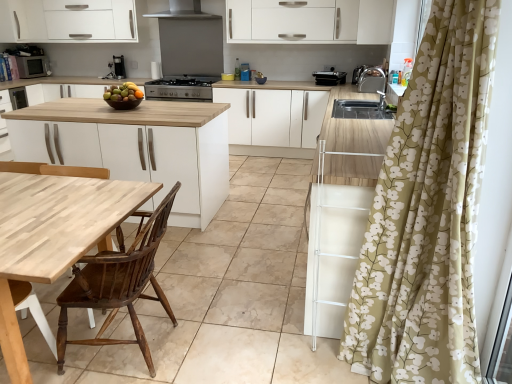
Identify the location of stainless steel exhaust hood at upper center. The image size is (512, 384). (183, 11).

How much space does white matte cabinet at upper left, which is the 1th cabinetry from left to right, occupy horizontally?

white matte cabinet at upper left, which is the 1th cabinetry from left to right, is 15.62 inches in width.

What do you see at coordinates (274, 120) in the screenshot?
I see `white matte cabinet at center, acting as the 3th cabinetry starting from the top` at bounding box center [274, 120].

Locate an element on the screen. This screenshot has height=384, width=512. white matte cabinet at upper right, positioned as the second cabinetry in top-to-bottom order is located at coordinates (375, 22).

In the scene shown: How much space does light brown wood chair at lower left, which appears as the second chair when viewed from the left, occupy vertically?

light brown wood chair at lower left, which appears as the second chair when viewed from the left, is 81.60 centimeters in height.

Identify the location of shiny brown bowl of mixed fruits at center. This screenshot has width=512, height=384. (123, 92).

Does wooden chair at left, the 1th chair positioned from the left, appear on the left side of white matte cabinet at upper left, the first cabinetry viewed from the top?

In fact, wooden chair at left, the 1th chair positioned from the left, is to the right of white matte cabinet at upper left, the first cabinetry viewed from the top.

Is wooden chair at left, acting as the 3th chair starting from the right, located outside white matte cabinet at upper left, which is the 1th cabinetry from left to right?

Indeed, wooden chair at left, acting as the 3th chair starting from the right, is completely outside white matte cabinet at upper left, which is the 1th cabinetry from left to right.

From a real-world perspective, is wooden chair at left, the 1th chair positioned from the left, on top of white matte cabinet at upper left, which appears as the 3th cabinetry when ordered from the bottom?

No.

Can you see shiny brown bowl of mixed fruits at center touching white matte cabinet at center, the 2th cabinetry in the right-to-left sequence?

No, shiny brown bowl of mixed fruits at center is not touching white matte cabinet at center, the 2th cabinetry in the right-to-left sequence.

Would you say shiny brown bowl of mixed fruits at center is outside white matte cabinet at center, the 1th cabinetry when ordered from bottom to top?

Yes, shiny brown bowl of mixed fruits at center is not within white matte cabinet at center, the 1th cabinetry when ordered from bottom to top.

Identify the location of fruit on the left of white matte cabinet at center, the 2th cabinetry in the right-to-left sequence. 123,92.

From a real-world perspective, between shiny brown bowl of mixed fruits at center and white matte cabinet at center, the 1th cabinetry when ordered from bottom to top, who is vertically higher?

shiny brown bowl of mixed fruits at center.

Is stainless steel exhaust hood at upper center thinner than white matte cabinet at upper right, the 3th cabinetry when ordered from left to right?

Incorrect, the width of stainless steel exhaust hood at upper center is not less than that of white matte cabinet at upper right, the 3th cabinetry when ordered from left to right.

Considering the sizes of stainless steel exhaust hood at upper center and white matte cabinet at upper right, the 3th cabinetry when ordered from left to right, in the image, is stainless steel exhaust hood at upper center taller or shorter than white matte cabinet at upper right, the 3th cabinetry when ordered from left to right,?

In the image, stainless steel exhaust hood at upper center appears to be shorter than white matte cabinet at upper right, the 3th cabinetry when ordered from left to right.

Is the depth of stainless steel exhaust hood at upper center greater than that of white matte cabinet at upper right, positioned as the second cabinetry in top-to-bottom order?

That is True.

From the image's perspective, which one is positioned lower, stainless steel exhaust hood at upper center or white matte cabinet at upper right, positioned as the second cabinetry in top-to-bottom order?

From the image's view, white matte cabinet at upper right, positioned as the second cabinetry in top-to-bottom order, is below.

Is wooden at left, which is counted as the first chair, starting from the right, to the left or to the right of matte silver microwave at left, which ranks as the first appliance in top-to-bottom order, in the image?

Clearly, wooden at left, which is counted as the first chair, starting from the right, is on the right of matte silver microwave at left, which ranks as the first appliance in top-to-bottom order, in the image.

From a real-world perspective, relative to matte silver microwave at left, which ranks as the first appliance in top-to-bottom order, is wooden at left, which is counted as the first chair, starting from the right, vertically above or below?

In terms of real-world spatial position, wooden at left, which is counted as the first chair, starting from the right, is below matte silver microwave at left, which ranks as the first appliance in top-to-bottom order.

Considering the relative sizes of wooden at left, which is counted as the first chair, starting from the right, and matte silver microwave at left, the third appliance when ordered from front to back, in the image provided, is wooden at left, which is counted as the first chair, starting from the right, smaller than matte silver microwave at left, the third appliance when ordered from front to back,?

Incorrect, wooden at left, which is counted as the first chair, starting from the right, is not smaller in size than matte silver microwave at left, the third appliance when ordered from front to back.

Does wooden at left, which is counted as the first chair, starting from the right, have a greater height compared to matte silver microwave at left, which ranks as the third appliance in right-to-left order?

Indeed, wooden at left, which is counted as the first chair, starting from the right, has a greater height compared to matte silver microwave at left, which ranks as the third appliance in right-to-left order.

Locate an element on the screen. exhaust hood behind the satin nickel faucet at upper right, positioned as the third appliance in top-to-bottom order is located at coordinates (183, 11).

Is satin nickel faucet at upper right, the 3th appliance viewed from the left, outside of stainless steel exhaust hood at upper center?

Yes.

Measure the distance between satin nickel faucet at upper right, the 3th appliance viewed from the left, and stainless steel exhaust hood at upper center.

satin nickel faucet at upper right, the 3th appliance viewed from the left, is 3.08 meters away from stainless steel exhaust hood at upper center.

Is black matte stove at center oriented away from wooden at left, which is counted as the first chair, starting from the right?

No, black matte stove at center is not facing away from wooden at left, which is counted as the first chair, starting from the right.

In the scene shown: Between black matte stove at center and wooden at left, which is counted as the first chair, starting from the right, which one appears on the right side from the viewer's perspective?

black matte stove at center is more to the right.

Where is `kitchen appliance above the wooden at left, which is counted as the 3th chair, starting from the left (from a real-world perspective)`? kitchen appliance above the wooden at left, which is counted as the 3th chair, starting from the left (from a real-world perspective) is located at coordinates (181, 88).

Can you confirm if black matte stove at center is bigger than wooden at left, which is counted as the 3th chair, starting from the left?

Actually, black matte stove at center might be smaller than wooden at left, which is counted as the 3th chair, starting from the left.

Is matte silver microwave at left, which ranks as the third appliance in right-to-left order, located outside wooden at left, which is counted as the first chair, starting from the right?

Yes, matte silver microwave at left, which ranks as the third appliance in right-to-left order, is outside of wooden at left, which is counted as the first chair, starting from the right.

In the scene shown: Which point is more forward, (35, 75) or (16, 170)?

The point (16, 170) is in front.

Can you confirm if matte silver microwave at left, the third appliance when ordered from front to back, is smaller than wooden at left, which is counted as the 3th chair, starting from the left?

Indeed, matte silver microwave at left, the third appliance when ordered from front to back, has a smaller size compared to wooden at left, which is counted as the 3th chair, starting from the left.

In the scene shown: In the image, is matte silver microwave at left, which is the 1th appliance from back to front, on the left side or the right side of wooden at left, which is counted as the first chair, starting from the right?

In the image, matte silver microwave at left, which is the 1th appliance from back to front, appears on the left side of wooden at left, which is counted as the first chair, starting from the right.

Starting from the white matte cabinet at upper left, which is the third cabinetry in right-to-left order, which chair is the 1st one to the right? Please provide its 2D coordinates.

[(118, 283)]

Where is `fruit that appears on the left of white matte cabinet at center, the 1th cabinetry when ordered from bottom to top`? The width and height of the screenshot is (512, 384). fruit that appears on the left of white matte cabinet at center, the 1th cabinetry when ordered from bottom to top is located at coordinates (123, 92).

Which object lies nearer to the anchor point stainless steel exhaust hood at upper center, matte silver microwave at left, acting as the 3th appliance starting from the bottom, or white matte cabinet at upper right, positioned as the second cabinetry in top-to-bottom order?

matte silver microwave at left, acting as the 3th appliance starting from the bottom, is positioned closer to the anchor stainless steel exhaust hood at upper center.

From the image, which object appears to be nearer to white matte cabinet at upper left, which is the 1th cabinetry from left to right, wooden at left, which is counted as the first chair, starting from the right, or wooden chair at left, acting as the 3th chair starting from the right?

wooden at left, which is counted as the first chair, starting from the right, is positioned closer to the anchor white matte cabinet at upper left, which is the 1th cabinetry from left to right.

Estimate the real-world distances between objects in this image. Which object is closer to wooden chair at left, the 1th chair positioned from the left, white matte cabinet at center, the 1th cabinetry when ordered from bottom to top, or stainless steel exhaust hood at upper center?

The object closer to wooden chair at left, the 1th chair positioned from the left, is white matte cabinet at center, the 1th cabinetry when ordered from bottom to top.

When comparing their distances from white matte cabinet at upper left, the first cabinetry viewed from the top, does wooden chair at left, acting as the 3th chair starting from the right, or stainless steel exhaust hood at upper center seem closer?

stainless steel exhaust hood at upper center is positioned closer to the anchor white matte cabinet at upper left, the first cabinetry viewed from the top.

Which object lies nearer to the anchor point black plastic toaster at upper right, the second appliance viewed from the back, white matte cabinet at center, the 1th cabinetry when ordered from bottom to top, or matte silver microwave at left, which ranks as the first appliance in top-to-bottom order?

Among the two, white matte cabinet at center, the 1th cabinetry when ordered from bottom to top, is located nearer to black plastic toaster at upper right, the second appliance viewed from the back.

Based on their spatial positions, is wooden chair at left, acting as the 3th chair starting from the right, or matte silver microwave at left, which ranks as the third appliance in right-to-left order, closer to wooden at left, which is counted as the 3th chair, starting from the left?

wooden chair at left, acting as the 3th chair starting from the right, is closer to wooden at left, which is counted as the 3th chair, starting from the left.

From the image, which object appears to be farther from light brown wood chair at lower left, which appears as the second chair when viewed from the left, satin nickel faucet at upper right, the 3th appliance viewed from the left, or white matte cabinet at center, the 2th cabinetry in the right-to-left sequence?

white matte cabinet at center, the 2th cabinetry in the right-to-left sequence.

When comparing their distances from wooden at left, which is counted as the first chair, starting from the right, does wooden chair at left, the 1th chair positioned from the left, or light brown wood chair at lower left, marked as the second chair in a right-to-left arrangement, seem further?

light brown wood chair at lower left, marked as the second chair in a right-to-left arrangement.

Locate an element on the screen. This screenshot has width=512, height=384. exhaust hood located between light brown wood chair at lower left, marked as the second chair in a right-to-left arrangement, and black plastic toaster at upper right, which appears as the second appliance when viewed from the front, in the depth direction is located at coordinates (183, 11).

Where is `kitchen appliance between white matte cabinet at upper left, the first cabinetry viewed from the top, and stainless steel exhaust hood at upper center`? kitchen appliance between white matte cabinet at upper left, the first cabinetry viewed from the top, and stainless steel exhaust hood at upper center is located at coordinates (181, 88).

Locate an element on the screen. This screenshot has height=384, width=512. fruit between matte silver microwave at left, the third appliance when ordered from front to back, and white matte cabinet at center, the 2th cabinetry in the right-to-left sequence is located at coordinates (123, 92).

What are the coordinates of `exhaust hood between matte silver microwave at left, acting as the 3th appliance starting from the bottom, and satin nickel faucet at upper right, the 1th appliance ordered from the bottom, from left to right` in the screenshot? It's located at (183, 11).